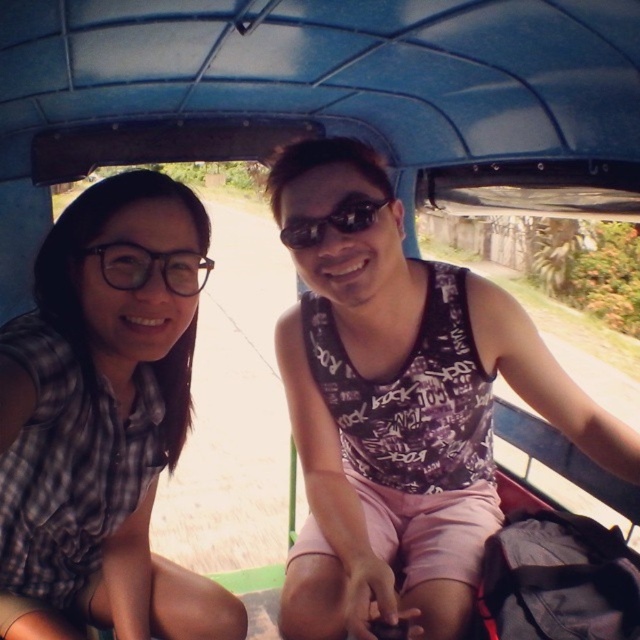
Does plaid fabric shirt at left appear under transparent plastic glasses at left?

Yes.

You are a GUI agent. You are given a task and a screenshot of the screen. Output one action in this format:
    pyautogui.click(x=<x>, y=<y>)
    Task: Click on the plaid fabric shirt at left
    The height and width of the screenshot is (640, 640).
    Given the screenshot: What is the action you would take?
    pyautogui.click(x=106, y=412)

Is matte black tank top at center thinner than sunglasses at center?

Incorrect, matte black tank top at center's width is not less than sunglasses at center's.

How much distance is there between matte black tank top at center and sunglasses at center?

matte black tank top at center and sunglasses at center are 13.98 inches apart from each other.

Is point (397, 515) farther from viewer compared to point (300, 221)?

Yes.

This screenshot has width=640, height=640. In order to click on matte black tank top at center in this screenshot , I will do `click(401, 410)`.

Is transparent plastic glasses at left thinner than sunglasses at center?

Yes, transparent plastic glasses at left is thinner than sunglasses at center.

Does point (168, 280) lie behind point (348, 212)?

That is False.

Is point (177, 285) positioned before point (362, 216)?

Yes.

In order to click on transparent plastic glasses at left in this screenshot , I will do `click(150, 266)`.